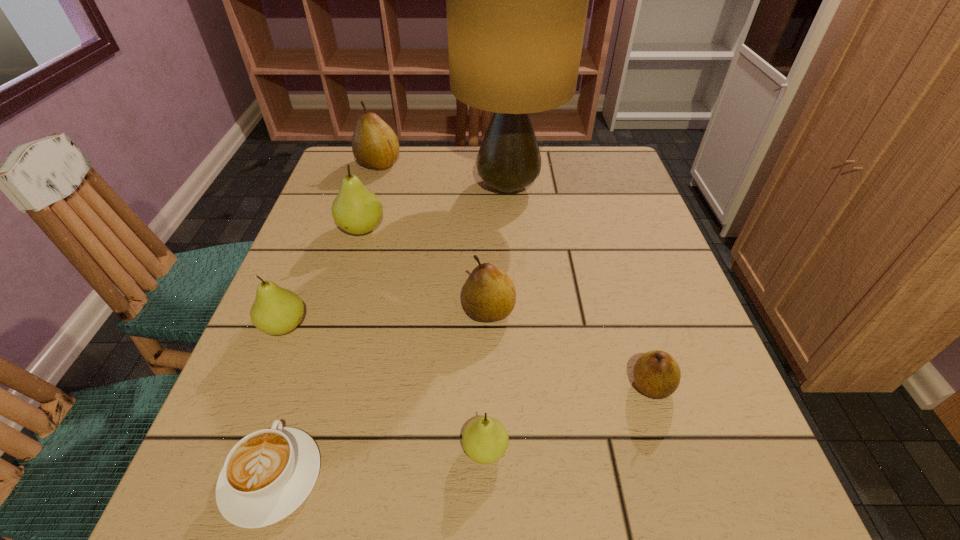
Choose which brown pear is the third nearest neighbor to the beige lampshade. Please provide its 2D coordinates. Your answer should be formatted as a tuple, i.e. [(x, y)], where the tuple contains the x and y coordinates of a point satisfying the conditions above.

[(656, 373)]

Point out which green pear is positioned as the nearest to the biggest green pear. Please provide its 2D coordinates. Your answer should be formatted as a tuple, i.e. [(x, y)], where the tuple contains the x and y coordinates of a point satisfying the conditions above.

[(276, 311)]

Find the location of `green pear object that ranks as the second closest to the second brown pear from left to right`. green pear object that ranks as the second closest to the second brown pear from left to right is located at coordinates (356, 210).

This screenshot has width=960, height=540. Identify the location of vacant space that satisfies the following two spatial constraints: 1. on the front side of the biggest green pear; 2. on the left side of the farthest pear. (359, 229).

Locate an element on the screen. vacant position in the image that satisfies the following two spatial constraints: 1. on the side of the cappuccino with the handle; 2. on the right side of the farthest green pear is located at coordinates (352, 229).

You are a GUI agent. You are given a task and a screenshot of the screen. Output one action in this format:
    pyautogui.click(x=<x>, y=<y>)
    Task: Click on the vacant area that satisfies the following two spatial constraints: 1. on the front side of the second farthest green pear; 2. on the right side of the smallest green pear
    The image size is (960, 540).
    Given the screenshot: What is the action you would take?
    pyautogui.click(x=235, y=449)

At what (x,y) coordinates should I click in order to perform the action: click on blank space that satisfies the following two spatial constraints: 1. on the side of the white cappuccino with the handle; 2. on the right side of the nearest pear. Please return your answer as a coordinate pair (x, y). This screenshot has height=540, width=960. Looking at the image, I should click on (281, 449).

Identify the location of vacant region that satisfies the following two spatial constraints: 1. on the side of the white cappuccino with the handle; 2. on the right side of the fifth farthest pear. The height and width of the screenshot is (540, 960). (302, 385).

You are a GUI agent. You are given a task and a screenshot of the screen. Output one action in this format:
    pyautogui.click(x=<x>, y=<y>)
    Task: Click on the free space that satisfies the following two spatial constraints: 1. on the back side of the second farthest pear; 2. on the left side of the beige lampshade
    The image size is (960, 540).
    Given the screenshot: What is the action you would take?
    point(374,187)

This screenshot has height=540, width=960. I want to click on vacant point that satisfies the following two spatial constraints: 1. on the back side of the second brown pear from left to right; 2. on the right side of the rightmost green pear, so click(484, 310).